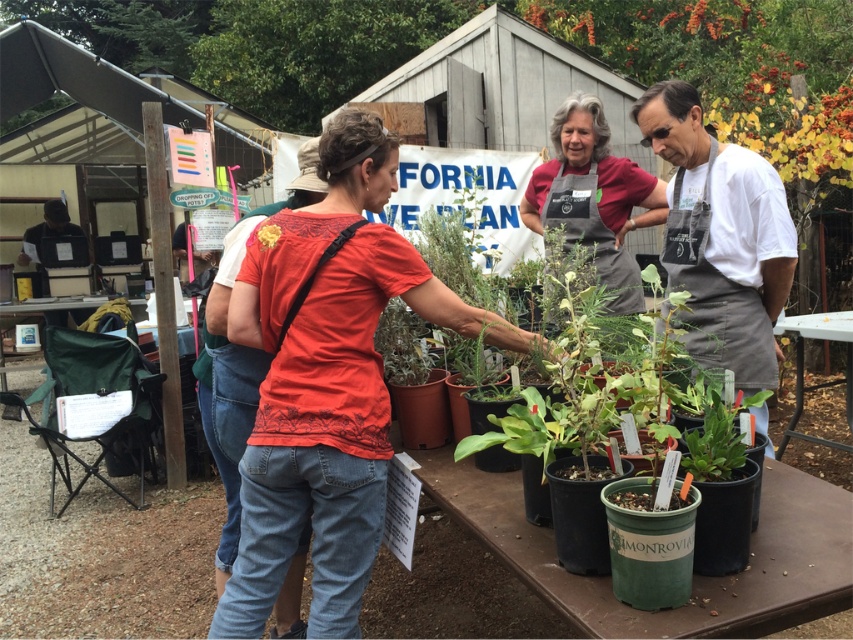
You are standing at the origin point in the scene. Where is the matte gray apron at center located in terms of coordinates?

The matte gray apron at center is located at coordinates point (595, 196).

You are a participant at this plant event and need to choose an apron to protect your clothes. Both the white apron at center and the matte gray apron at center are available. Based on their sizes, which apron would cover more of your torso?

The white apron at center has a greater height compared to the matte gray apron at center, so it would cover more of your torso.

You are a gardener looking at the table with plants. There is a matte gray apron at center and a yellow fabric flower at center. Which object is positioned higher on the table?

The matte gray apron at center is above the yellow fabric flower at center, so it is positioned higher on the table.